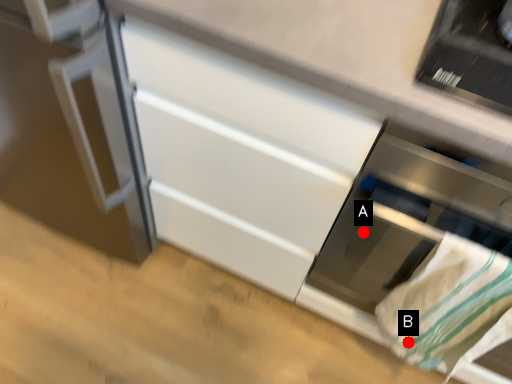
Question: Two points are circled on the image, labeled by A and B beside each circle. Which point appears closest to the camera in this image?

Choices:
 (A) A is closer
 (B) B is closer

Answer: (B)